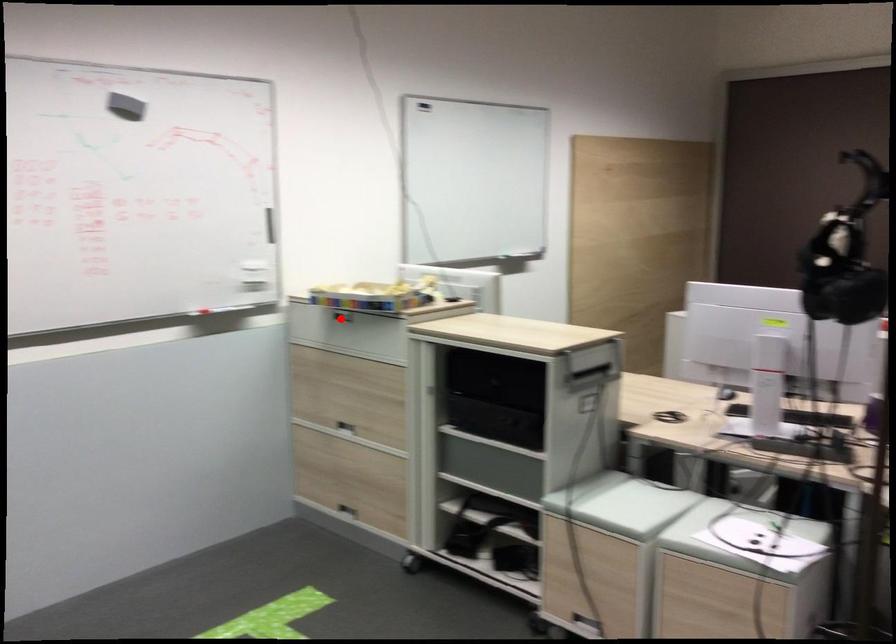
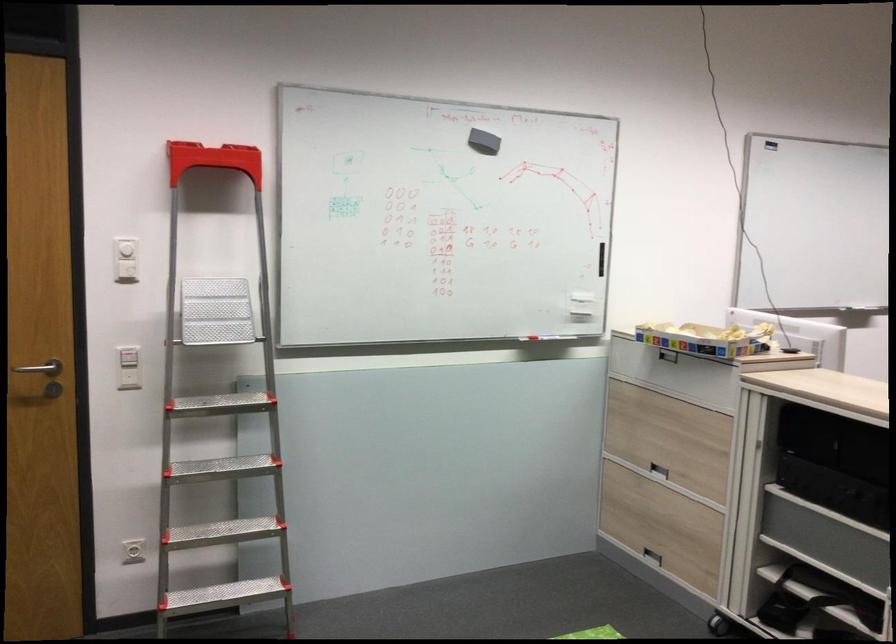
Locate, in the second image, the point that corresponds to the highlighted location in the first image.

(668, 355)